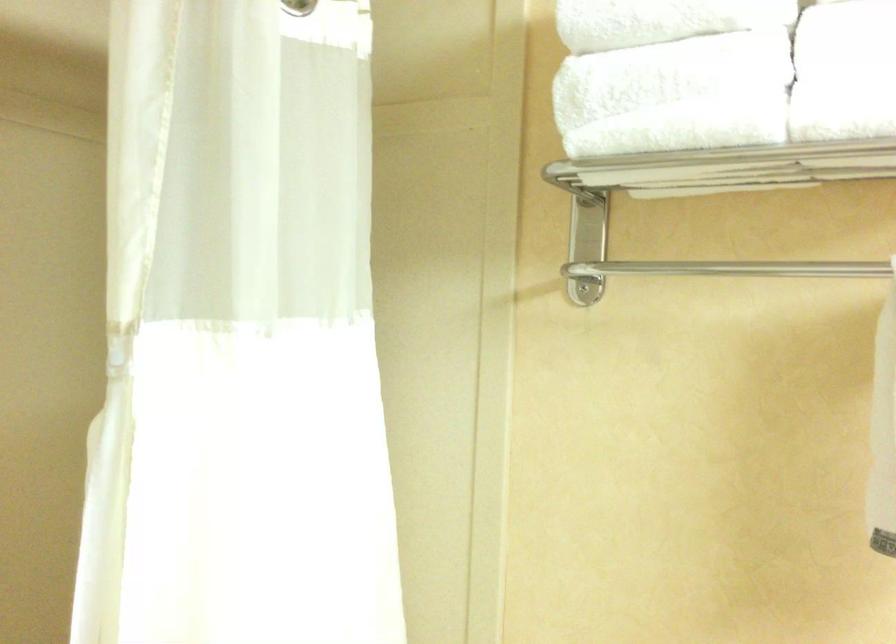
Identify the location of metal towel bar. (739, 169).